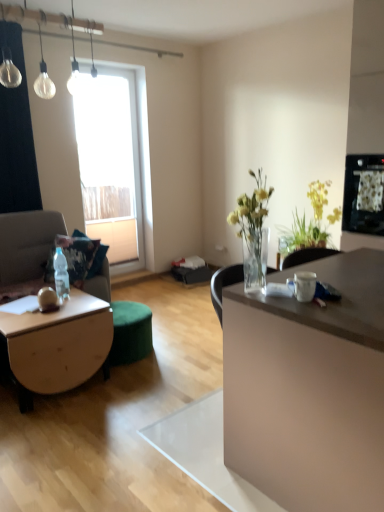
Locate an element on the screen. vacant region to the right of clear plastic bottle at lower left is located at coordinates (82, 297).